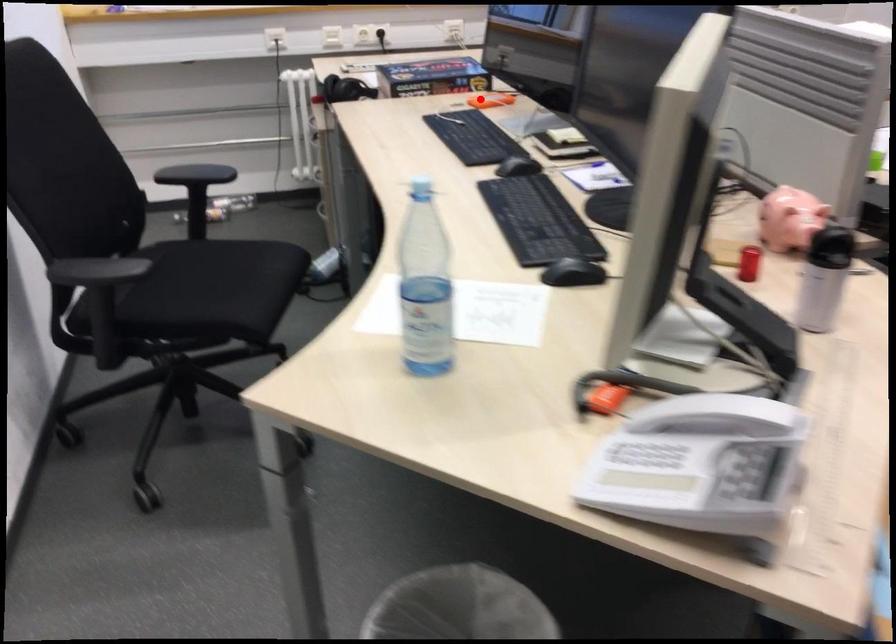
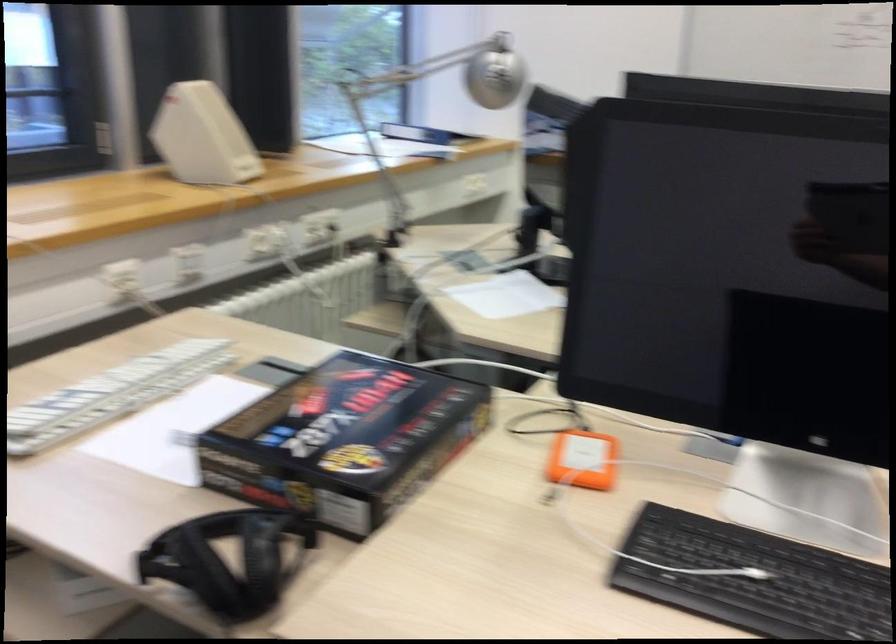
The point at the highlighted location is marked in the first image. Where is the corresponding point in the second image?

(582, 460)